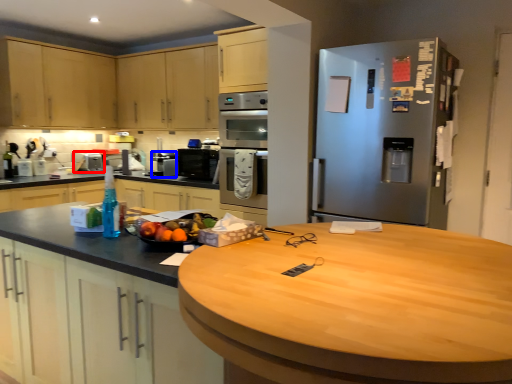
Question: Which object appears closest to the camera in this image, appliance (highlighted by a red box) or appliance (highlighted by a blue box)?

Choices:
 (A) appliance
 (B) appliance

Answer: (B)